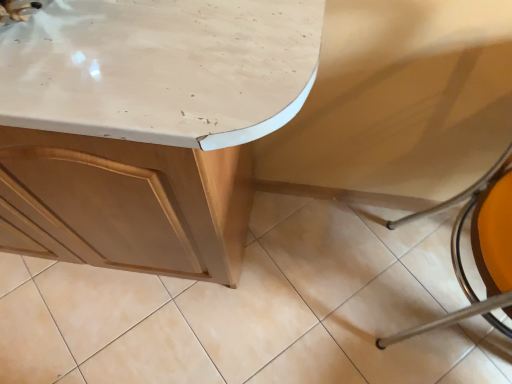
Locate an element on the screen. The image size is (512, 384). matte wood cabinet at center is located at coordinates [145, 127].

This screenshot has width=512, height=384. What do you see at coordinates (145, 127) in the screenshot?
I see `matte wood cabinet at center` at bounding box center [145, 127].

What is the approximate height of matte wood cabinet at center?

The height of matte wood cabinet at center is 33.46 inches.

You are a GUI agent. You are given a task and a screenshot of the screen. Output one action in this format:
    pyautogui.click(x=<x>, y=<y>)
    Task: Click on the matte wood cabinet at center
    
    Given the screenshot: What is the action you would take?
    pyautogui.click(x=145, y=127)